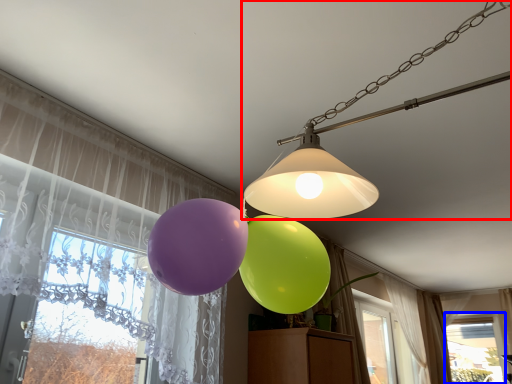
Question: Which of the following is the farthest to the observer, lamp (highlighted by a red box) or window (highlighted by a blue box)?

Choices:
 (A) lamp
 (B) window

Answer: (B)